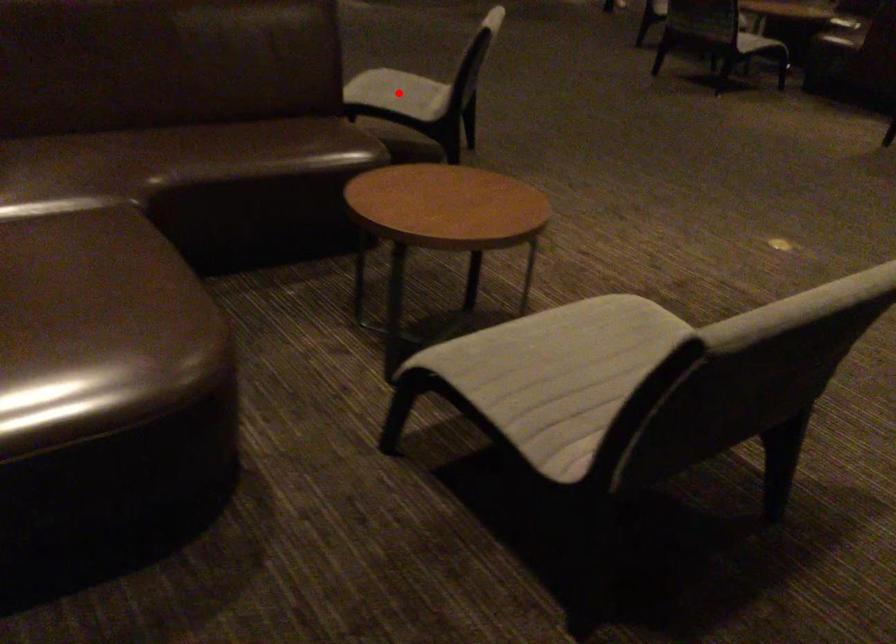
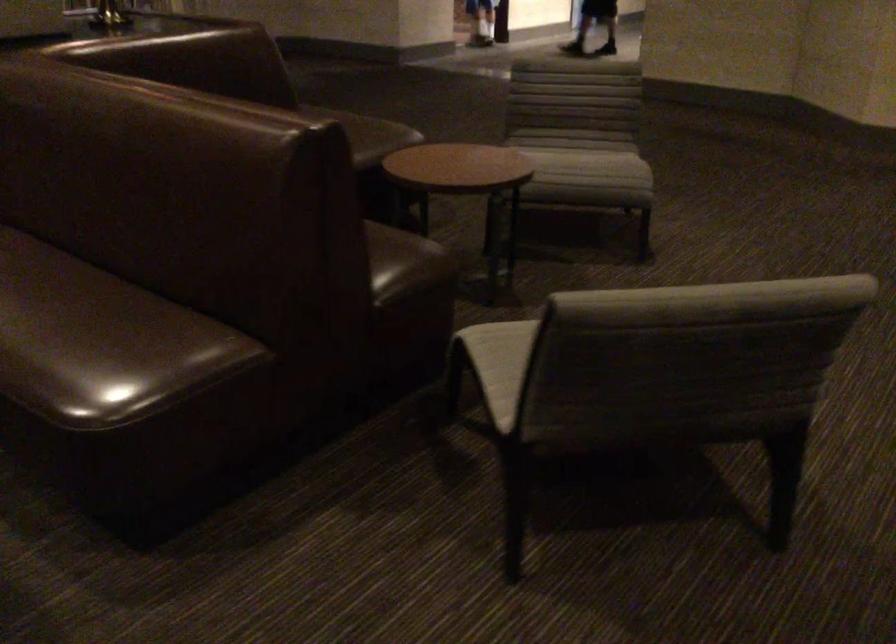
Question: I am providing you with two images of the same scene from different viewpoints. A red point is marked on the first image. At the location where the point appears in image 1, is it still visible in image 2?

Choices:
 (A) Yes
 (B) No

Answer: (B)